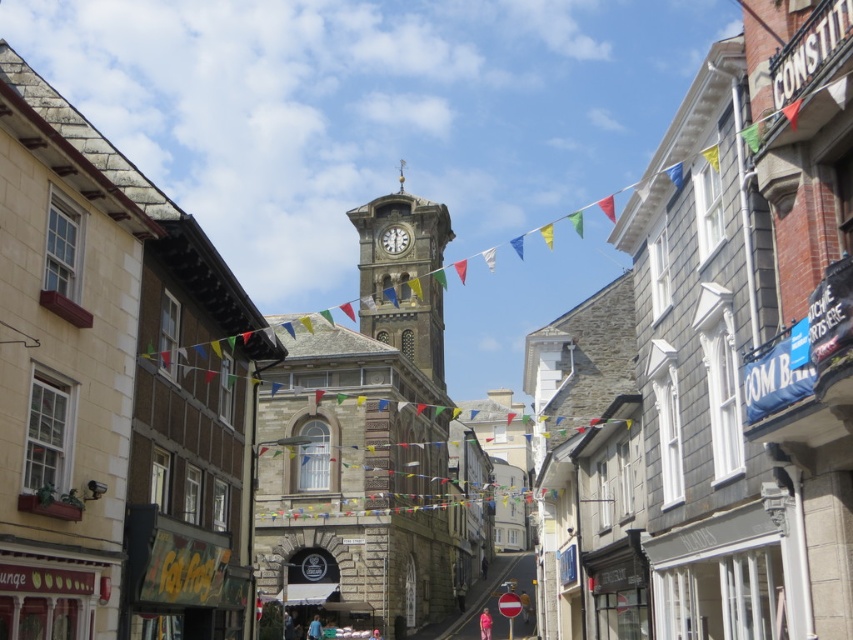
Question: Does stone clock tower at center have a larger size compared to white stone clock at center?

Choices:
 (A) yes
 (B) no

Answer: (A)

Question: Is the position of stone clock tower at center more distant than that of white stone clock at center?

Choices:
 (A) no
 (B) yes

Answer: (A)

Question: Does stone clock tower at center appear on the right side of white stone clock at center?

Choices:
 (A) yes
 (B) no

Answer: (A)

Question: Which of the following is the farthest from the observer?

Choices:
 (A) stone clock tower at center
 (B) white stone clock at center

Answer: (B)

Question: Which object is closer to the camera taking this photo?

Choices:
 (A) white stone clock at center
 (B) stone clock tower at center

Answer: (B)